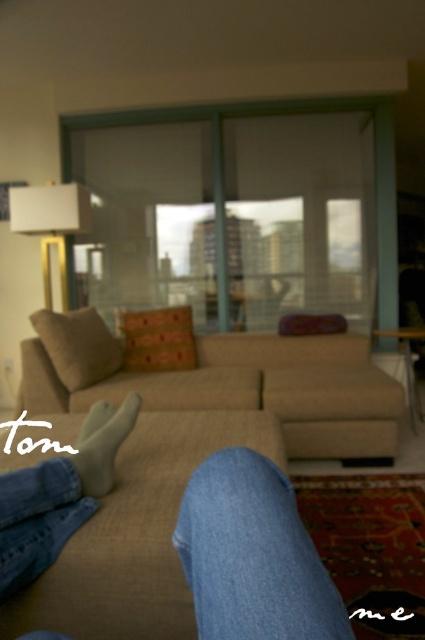
Does point (201, 540) come closer to viewer compared to point (101, 413)?

Yes, point (201, 540) is closer to viewer.

Can you confirm if blue denim jeans at lower center is wider than denim jeans at lower center?

Correct, the width of blue denim jeans at lower center exceeds that of denim jeans at lower center.

What do you see at coordinates (252, 556) in the screenshot? The image size is (425, 640). I see `blue denim jeans at lower center` at bounding box center [252, 556].

Locate an element on the screen. This screenshot has height=640, width=425. blue denim jeans at lower center is located at coordinates (252, 556).

Does point (65, 532) come farther from viewer compared to point (102, 458)?

No, (65, 532) is closer to viewer.

Is denim jeans at lower center positioned before white suede sock at lower center?

Yes, denim jeans at lower center is closer to the viewer.

At what (x,y) coordinates should I click in order to perform the action: click on denim jeans at lower center. Please return your answer as a coordinate pair (x, y). The image size is (425, 640). Looking at the image, I should click on coord(57,496).

Who is shorter, beige fabric couch at center or white suede sock at lower center?

Standing shorter between the two is white suede sock at lower center.

Find the location of a particular element. beige fabric couch at center is located at coordinates (224, 381).

At what (x,y) coordinates should I click in order to perform the action: click on beige fabric couch at center. Please return your answer as a coordinate pair (x, y). Looking at the image, I should click on (224, 381).